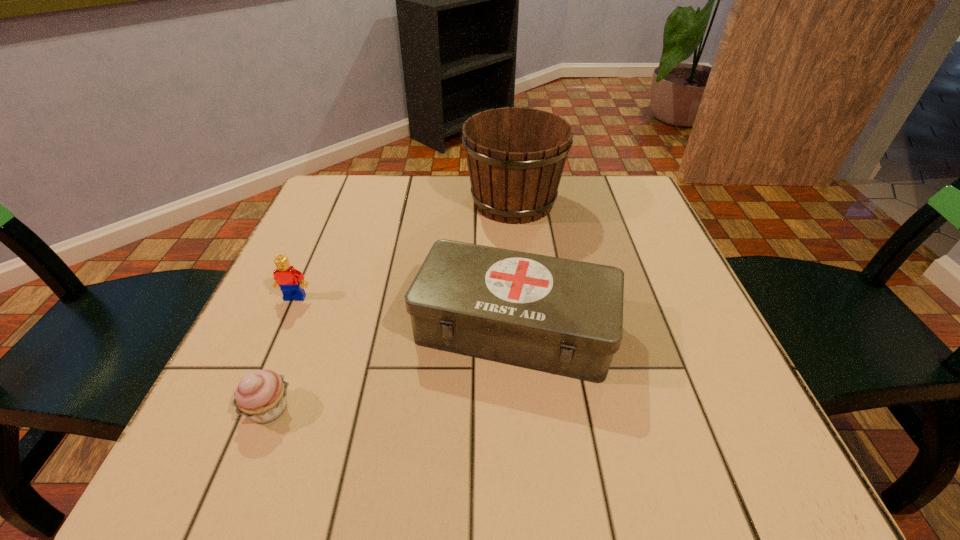
In the image, there is a desktop. Where is `vacant area at the near left corner`? The image size is (960, 540). vacant area at the near left corner is located at coordinates (276, 446).

The image size is (960, 540). In order to click on free space between the Lego and the nearest object in this screenshot , I will do `click(282, 353)`.

You are a GUI agent. You are given a task and a screenshot of the screen. Output one action in this format:
    pyautogui.click(x=<x>, y=<y>)
    Task: Click on the free spot between the shortest object and the Lego
    This screenshot has height=540, width=960.
    Given the screenshot: What is the action you would take?
    pyautogui.click(x=282, y=353)

Identify the location of free space between the Lego and the nearest object. This screenshot has width=960, height=540. (282, 353).

I want to click on free area in between the Lego and the first-aid kit, so click(405, 313).

At what (x,y) coordinates should I click in order to perform the action: click on free space between the shortest object and the tallest object. Please return your answer as a coordinate pair (x, y). Looking at the image, I should click on (391, 305).

Where is `vacant area between the nearest object and the Lego`? Image resolution: width=960 pixels, height=540 pixels. vacant area between the nearest object and the Lego is located at coordinates (282, 353).

At what (x,y) coordinates should I click in order to perform the action: click on unoccupied position between the tallest object and the shortest object. Please return your answer as a coordinate pair (x, y). The height and width of the screenshot is (540, 960). Looking at the image, I should click on (391, 305).

Locate an element on the screen. The width and height of the screenshot is (960, 540). vacant region between the Lego and the shortest object is located at coordinates (282, 353).

What are the coordinates of `empty space between the cupcake and the Lego` in the screenshot? It's located at (282, 353).